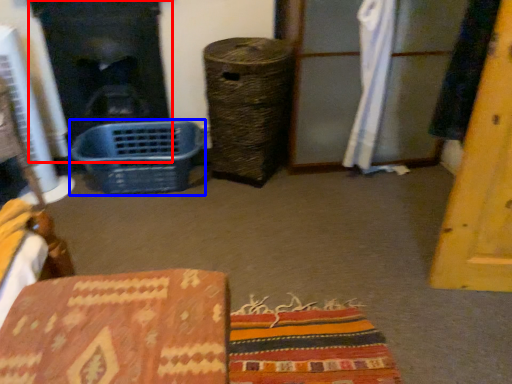
Question: Which of the following is the closest to the observer, fireplace (highlighted by a red box) or basket (highlighted by a blue box)?

Choices:
 (A) fireplace
 (B) basket

Answer: (B)